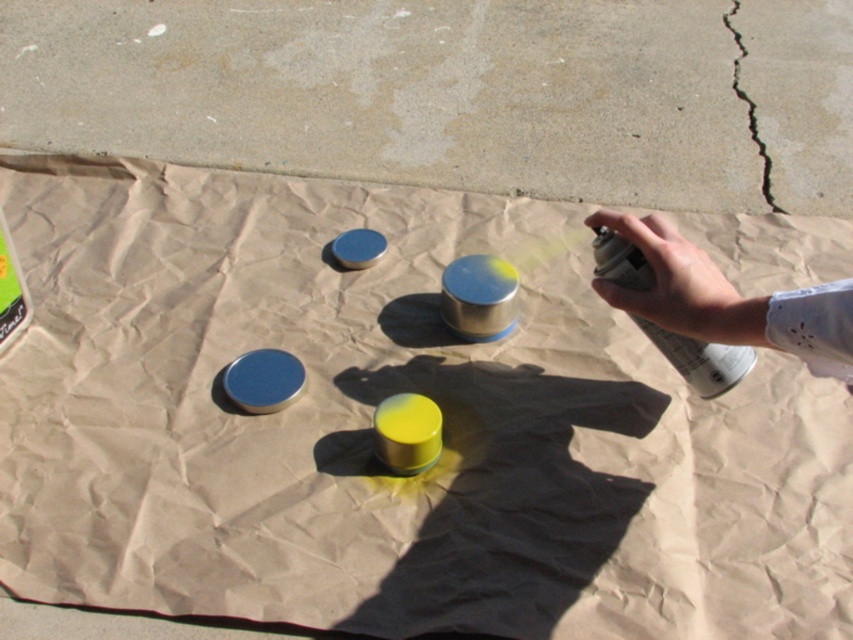
Question: Is metallic spray can at right to the right of cracked concrete at upper right from the viewer's perspective?

Choices:
 (A) yes
 (B) no

Answer: (B)

Question: Among these points, which one is farthest from the camera?

Choices:
 (A) (735, 29)
 (B) (646, 248)

Answer: (A)

Question: Is the position of metallic spray can at right less distant than that of cracked concrete at upper right?

Choices:
 (A) no
 (B) yes

Answer: (B)

Question: Can you confirm if metallic spray can at right is positioned to the right of cracked concrete at upper right?

Choices:
 (A) no
 (B) yes

Answer: (A)